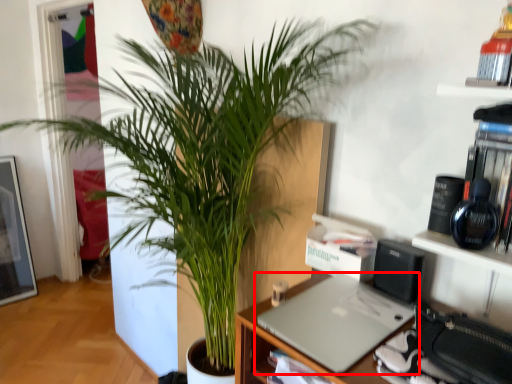
Question: From the image's perspective, what is the correct spatial positioning of laptop (annotated by the red box) in reference to houseplant?

Choices:
 (A) above
 (B) below

Answer: (B)